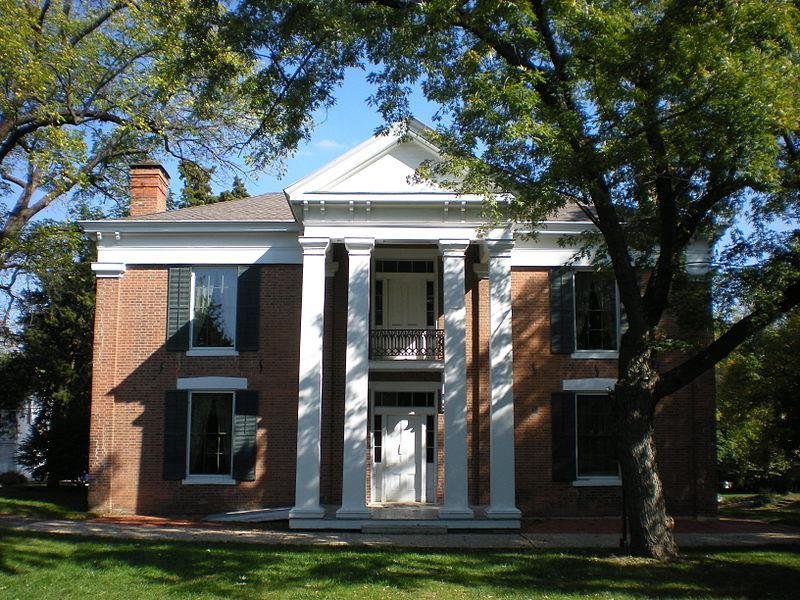
Identify the location of white door. (400, 453).